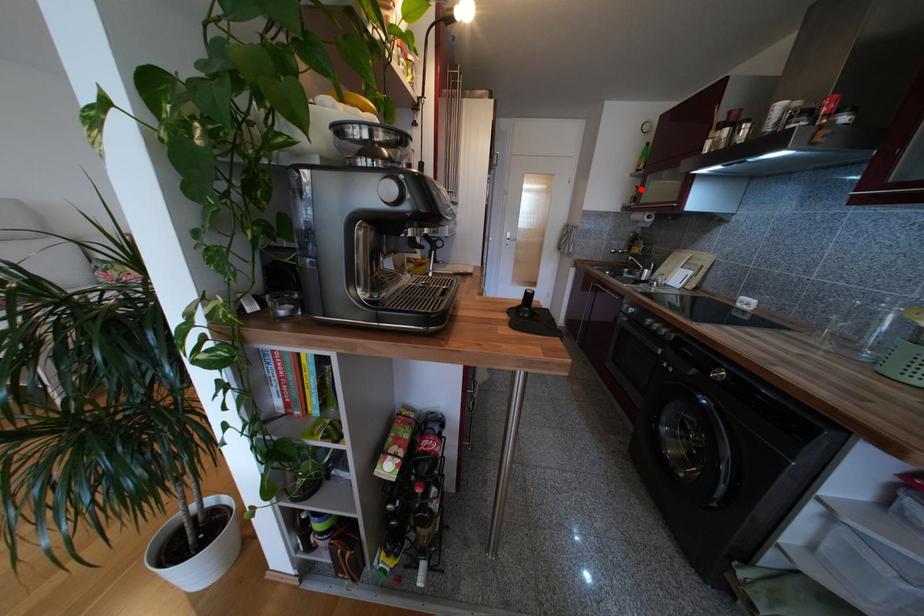
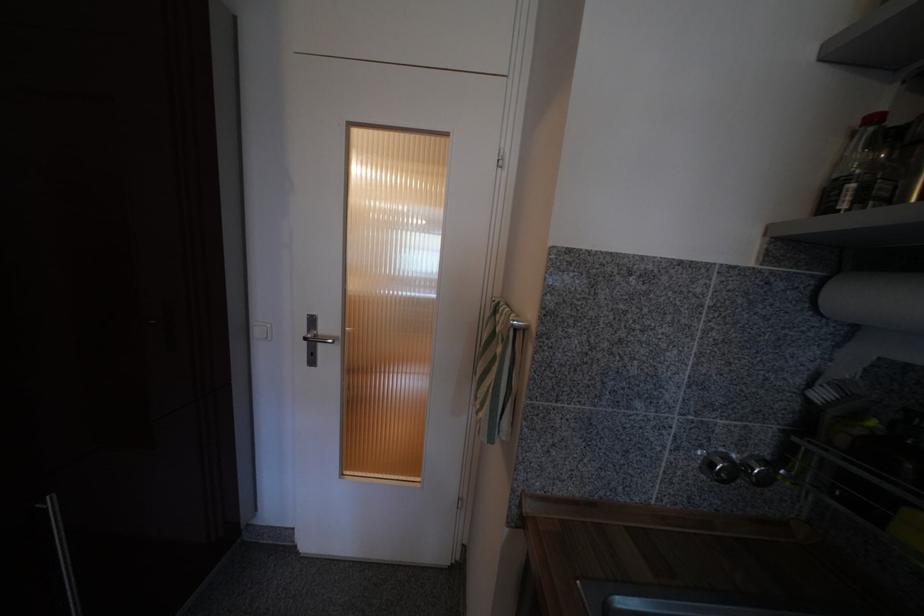
Question: I am providing you with two images of the same scene from different viewpoints. Given a red point in image1, look at the same physical point in image2. Is it:

Choices:
 (A) Closer to the viewpoint
 (B) Farther from the viewpoint

Answer: (B)